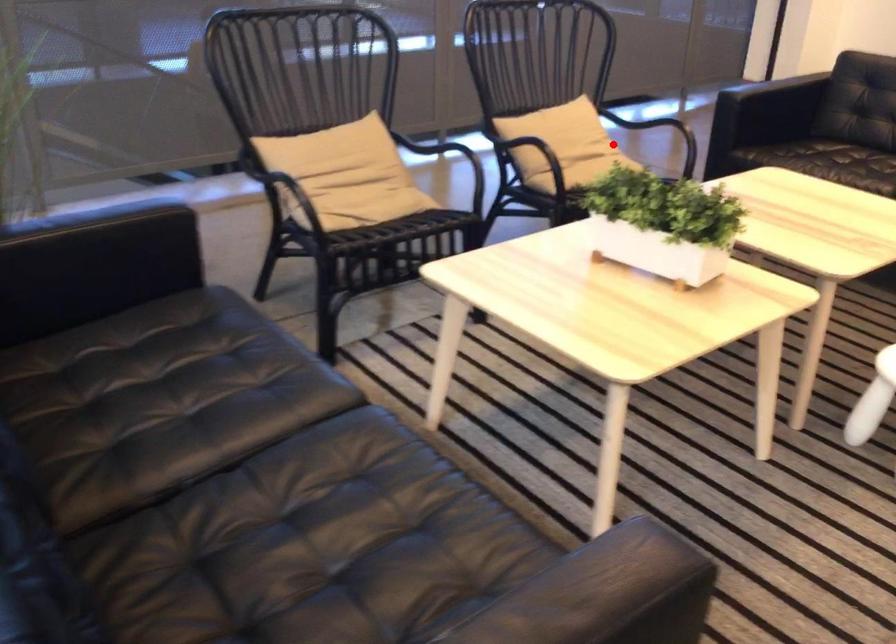
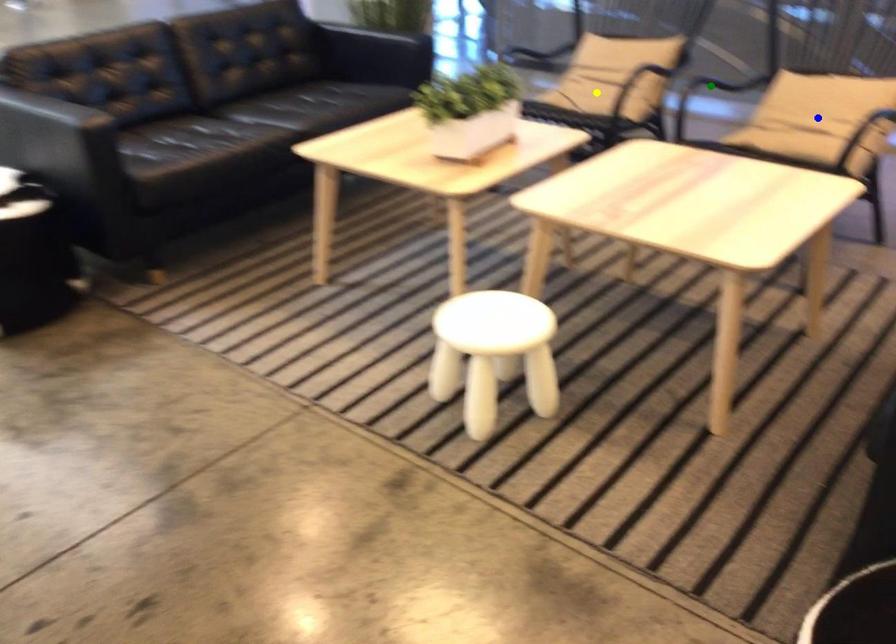
Question: I am providing you with two images of the same scene from different viewpoints. A red point is marked on the first image. You are given multiple points on the second image. Which spot in image 2 lines up with the point in image 1?

Choices:
 (A) yellow point
 (B) green point
 (C) blue point

Answer: (C)